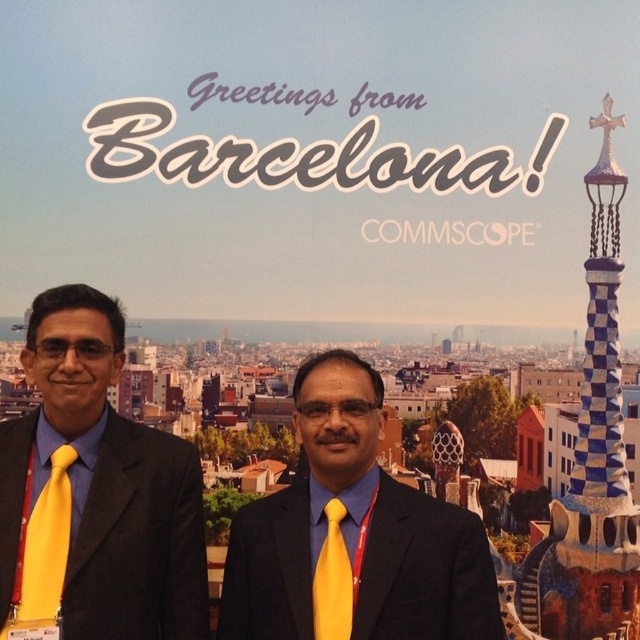
Question: In this image, where is yellow satin tie at left located relative to yellow satin tie at center?

Choices:
 (A) above
 (B) below

Answer: (A)

Question: Does yellow matte suit at center appear over yellow satin tie at center?

Choices:
 (A) no
 (B) yes

Answer: (B)

Question: Which object is the closest to the matte black suit at left?

Choices:
 (A) yellow satin tie at left
 (B) yellow matte suit at center

Answer: (A)

Question: Is matte black suit at left smaller than yellow satin tie at center?

Choices:
 (A) no
 (B) yes

Answer: (A)

Question: Which object is the farthest from the matte black suit at left?

Choices:
 (A) yellow satin tie at center
 (B) yellow satin tie at left

Answer: (A)

Question: Which object is farther from the camera taking this photo?

Choices:
 (A) yellow matte suit at center
 (B) matte black suit at left

Answer: (A)